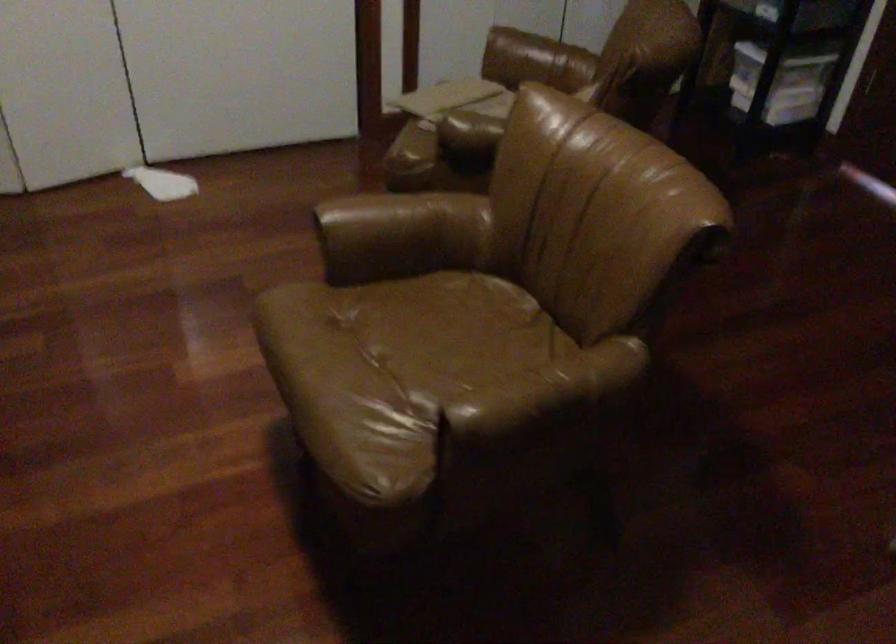
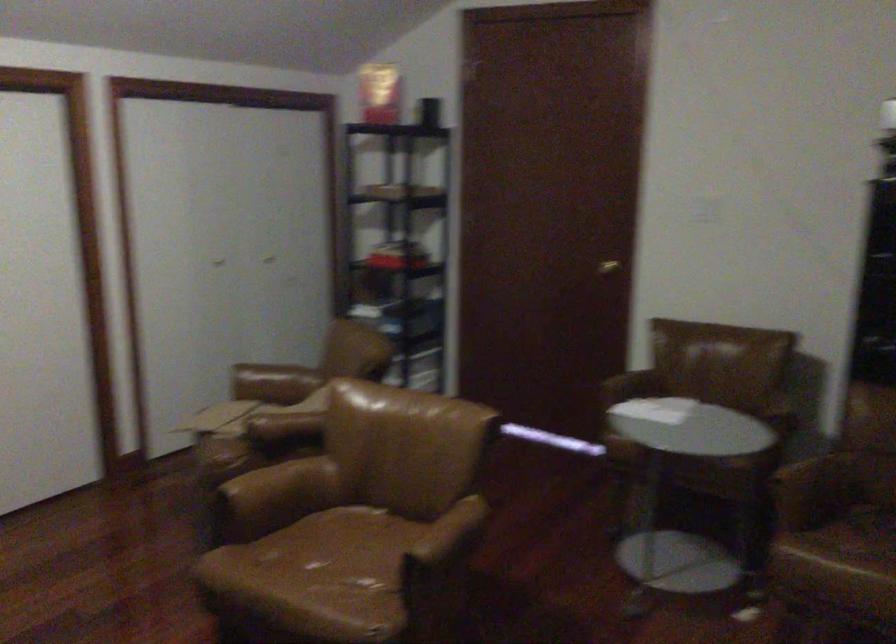
The point at (x=546, y=392) is marked in the first image. Where is the corresponding point in the second image?

(448, 536)